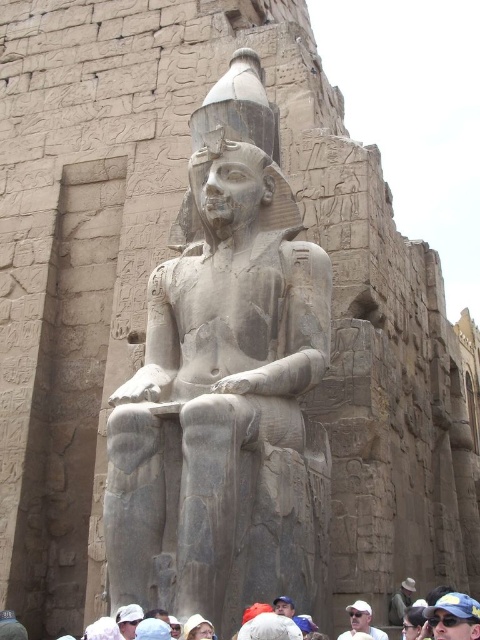
Can you confirm if white matte hat at center is positioned to the left of dark hair at lower center?

Indeed, white matte hat at center is positioned on the left side of dark hair at lower center.

Which of these two, white matte hat at center or dark hair at lower center, stands shorter?

dark hair at lower center

The height and width of the screenshot is (640, 480). In order to click on white matte hat at center in this screenshot , I will do `click(360, 621)`.

Does gray stone statue at center appear on the left side of khaki cotton shirt at lower center?

Correct, you'll find gray stone statue at center to the left of khaki cotton shirt at lower center.

Does gray stone statue at center lie behind khaki cotton shirt at lower center?

That is False.

You are a GUI agent. You are given a task and a screenshot of the screen. Output one action in this format:
    pyautogui.click(x=<x>, y=<y>)
    Task: Click on the gray stone statue at center
    The width and height of the screenshot is (480, 640).
    Given the screenshot: What is the action you would take?
    pyautogui.click(x=225, y=385)

You are a GUI agent. You are given a task and a screenshot of the screen. Output one action in this format:
    pyautogui.click(x=<x>, y=<y>)
    Task: Click on the gray stone statue at center
    The image size is (480, 640).
    Given the screenshot: What is the action you would take?
    pyautogui.click(x=225, y=385)

Is white matte hat at center positioned in front of white fabric cap at lower center?

No, it is not.

Does white matte hat at center lie behind white fabric cap at lower center?

Yes, white matte hat at center is behind white fabric cap at lower center.

Identify the location of white matte hat at center. [360, 621].

This screenshot has width=480, height=640. In order to click on white matte hat at center in this screenshot , I will do `click(360, 621)`.